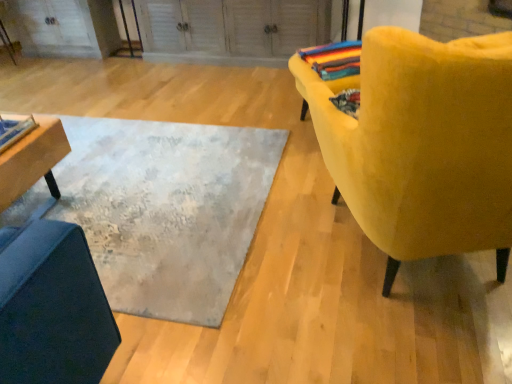
Question: Considering the relative positions of wooden table at left and velvet yellow chair at right in the image provided, is wooden table at left to the left or to the right of velvet yellow chair at right?

Choices:
 (A) right
 (B) left

Answer: (B)

Question: From the image's perspective, is wooden table at left above or below velvet yellow chair at right?

Choices:
 (A) below
 (B) above

Answer: (A)

Question: Estimate the real-world distances between objects in this image. Which object is farther from the velvet yellow chair at right?

Choices:
 (A) textured gray rug at center
 (B) multicolored woven blanket at upper right
 (C) wooden table at left

Answer: (C)

Question: Which object is positioned closest to the velvet yellow chair at right?

Choices:
 (A) wooden table at left
 (B) multicolored woven blanket at upper right
 (C) textured gray rug at center

Answer: (C)